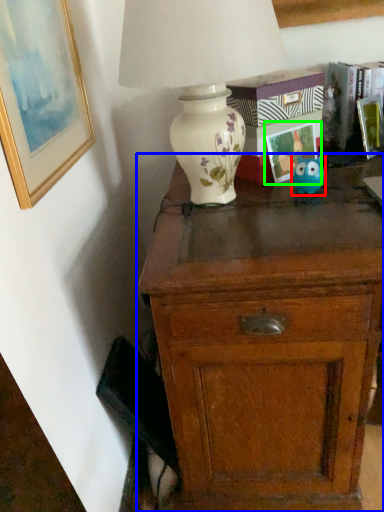
Question: Which is nearer to the toy (highlighted by a red box)? chest of drawers (highlighted by a blue box) or picture frame (highlighted by a green box).

Choices:
 (A) chest of drawers
 (B) picture frame

Answer: (B)